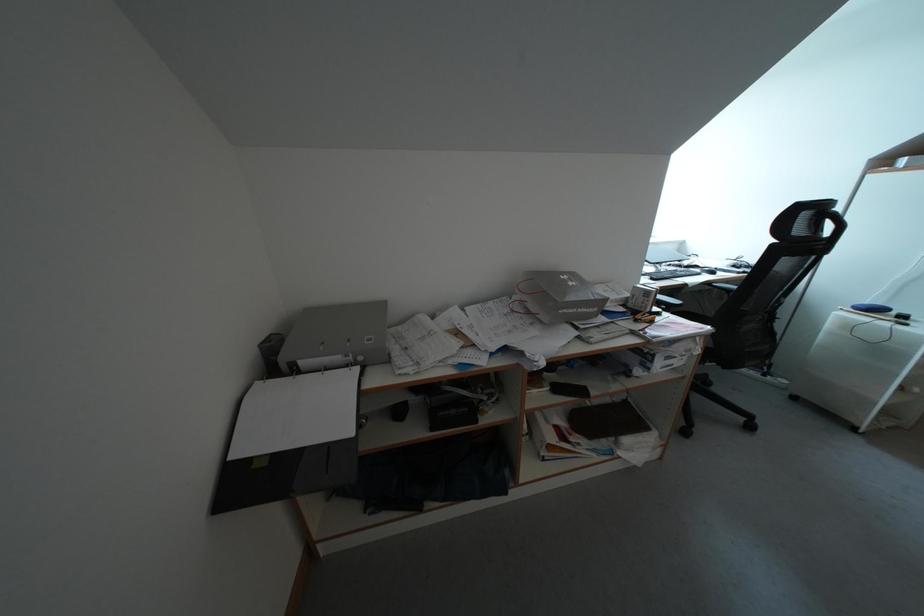
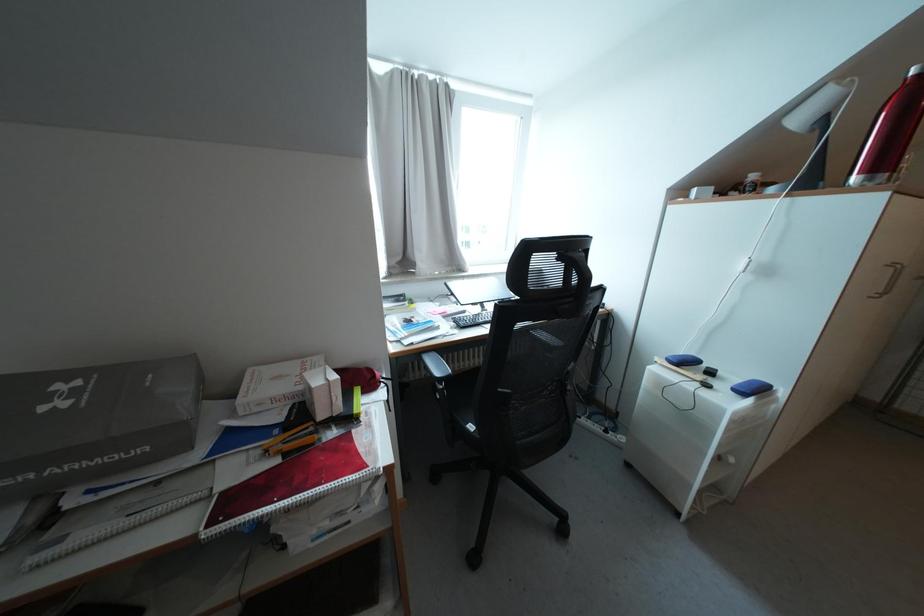
In a continuous first-person perspective shot, in which direction is the camera moving?

The cameraman walked toward right, forward.